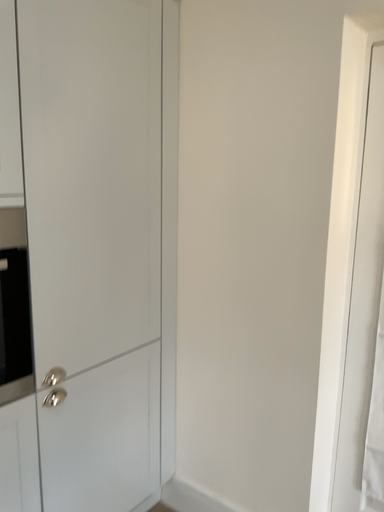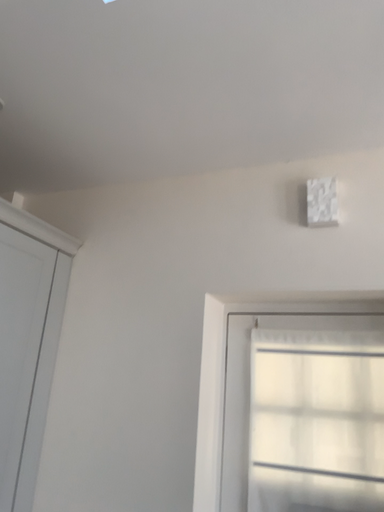
Question: Which way did the camera rotate in the video?

Choices:
 (A) rotated left
 (B) rotated right

Answer: (B)